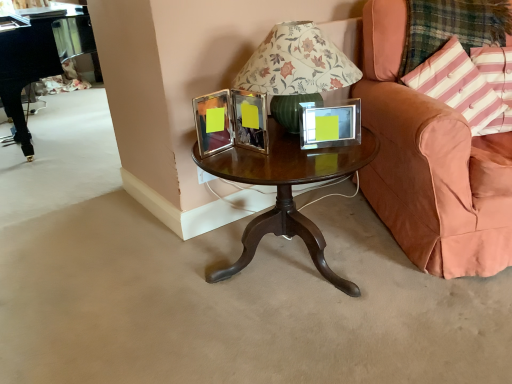
The height and width of the screenshot is (384, 512). Find the location of `free space to the left of mahogany wood coffee table at center`. free space to the left of mahogany wood coffee table at center is located at coordinates (143, 298).